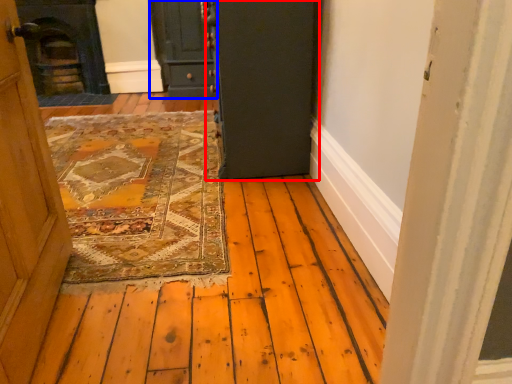
Question: Which point is further to the camera, door (highlighted by a red box) or door (highlighted by a blue box)?

Choices:
 (A) door
 (B) door

Answer: (B)